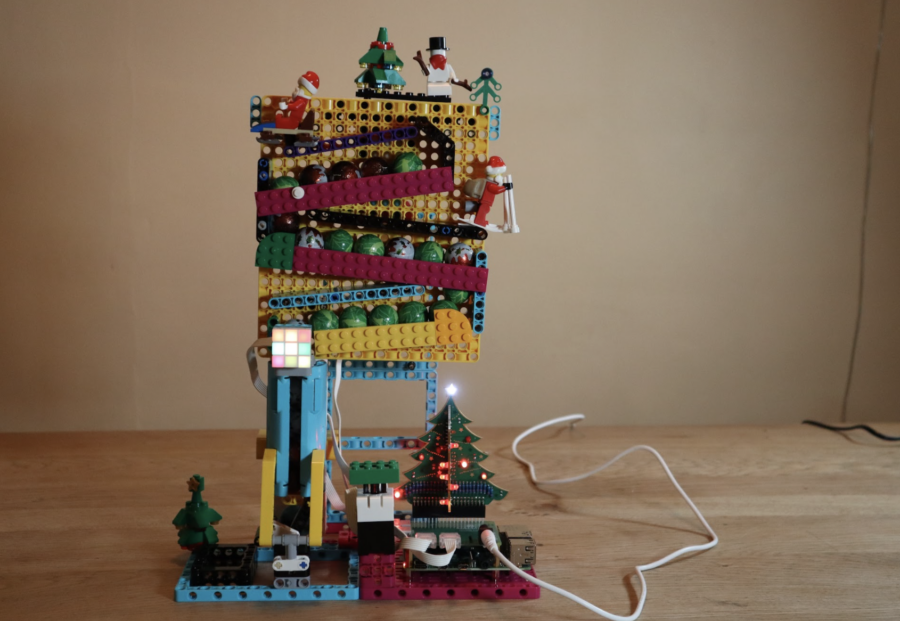
At what (x,y) coordinates should I click in order to perform the action: click on white cord. Please return your answer as a coordinate pair (x, y). This screenshot has width=900, height=621. Looking at the image, I should click on click(684, 548).